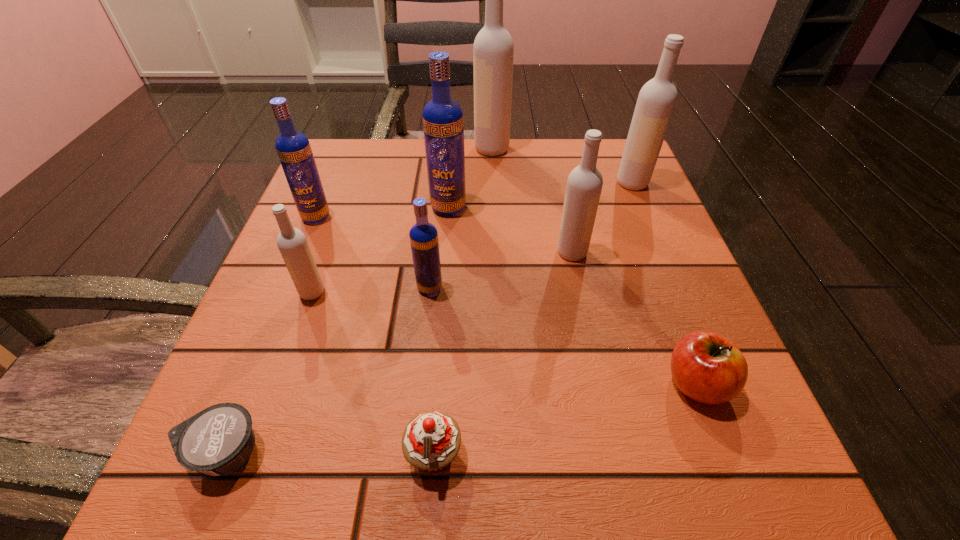
This screenshot has height=540, width=960. What are the coordinates of `object that is at the near left corner` in the screenshot? It's located at (219, 439).

The image size is (960, 540). In order to click on object located in the far right corner section of the desktop in this screenshot , I will do `click(657, 98)`.

I want to click on blank space at the far edge of the desktop, so click(x=480, y=157).

In the image, there is a desktop. Find the location of `vacant area at the near edge`. vacant area at the near edge is located at coordinates (588, 435).

Locate an element on the screen. This screenshot has width=960, height=540. free space at the left edge of the desktop is located at coordinates (277, 264).

Locate an element on the screen. Image resolution: width=960 pixels, height=540 pixels. vacant space at the right edge is located at coordinates (612, 312).

Locate an element on the screen. blank area at the far left corner is located at coordinates (367, 139).

Find the location of a particular element. free space at the near right corner of the desktop is located at coordinates (682, 435).

Find the location of a particular element. free space between the smallest white vodka and the cupcake is located at coordinates (373, 374).

Locate an element on the screen. This screenshot has height=540, width=960. vacant space in between the second smallest blue vodka and the yogurt is located at coordinates (271, 334).